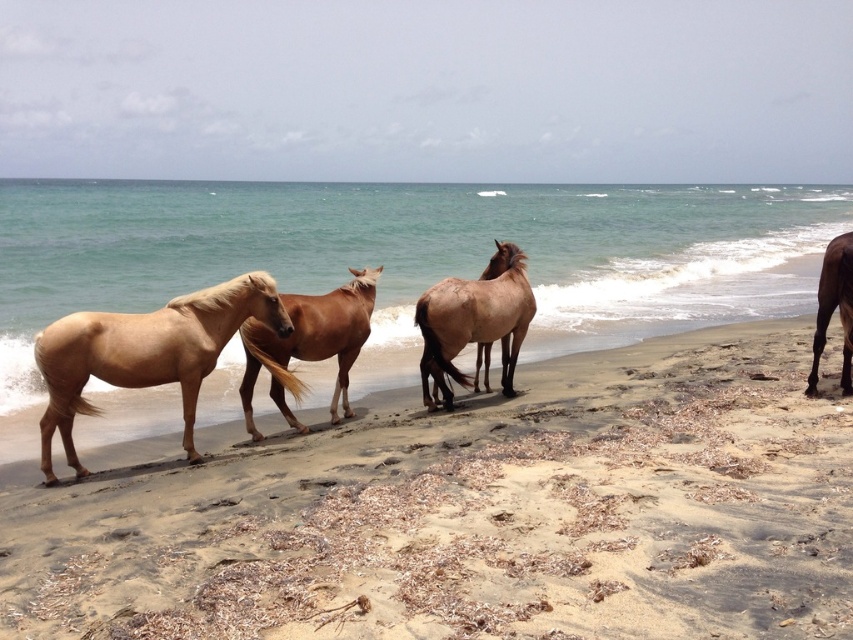
Consider the image. Can you confirm if light brown sandy beach at center is positioned below light brown glossy horse at center?

Yes, light brown sandy beach at center is below light brown glossy horse at center.

Where is `light brown sandy beach at center`? Image resolution: width=853 pixels, height=640 pixels. light brown sandy beach at center is located at coordinates (473, 512).

Between point (286, 413) and point (836, 246), which one is positioned in front?

Point (286, 413)

Between point (292, 314) and point (820, 272), which one is positioned behind?

The point (820, 272) is behind.

Where is `light brown glossy horse at center`? The image size is (853, 640). light brown glossy horse at center is located at coordinates (309, 344).

Which of these two, light brown sandy beach at center or brown glossy horse at right, stands shorter?

light brown sandy beach at center

Between point (209, 579) and point (849, 365), which one is positioned behind?

The point (849, 365) is behind.

Measure the distance between light brown sandy beach at center and camera.

A distance of 12.57 feet exists between light brown sandy beach at center and camera.

The height and width of the screenshot is (640, 853). What are the coordinates of `light brown sandy beach at center` in the screenshot? It's located at (473, 512).